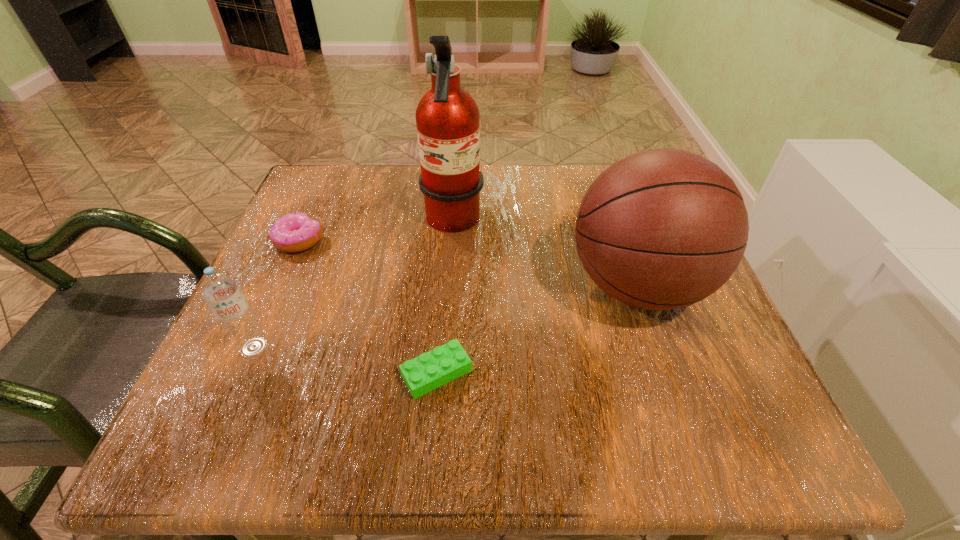
Locate an element on the screen. free spot at the near left corner of the desktop is located at coordinates (290, 424).

Find the location of a particular element. free space between the second tallest object and the water bottle is located at coordinates (445, 316).

The image size is (960, 540). What are the coordinates of `vacant area that lies between the rightmost object and the water bottle` in the screenshot? It's located at (445, 316).

Where is `vacant point located between the doughnut and the basketball`? vacant point located between the doughnut and the basketball is located at coordinates (468, 263).

This screenshot has height=540, width=960. Find the location of `empty space between the fire extinguisher and the doughnut`. empty space between the fire extinguisher and the doughnut is located at coordinates (376, 232).

Locate an element on the screen. vacant space that is in between the doughnut and the rightmost object is located at coordinates (468, 263).

Locate an element on the screen. vacant area that lies between the water bottle and the tallest object is located at coordinates (353, 285).

Where is `free space between the second shortest object and the water bottle`? Image resolution: width=960 pixels, height=540 pixels. free space between the second shortest object and the water bottle is located at coordinates (276, 294).

The image size is (960, 540). Find the location of `free space that is in between the rightmost object and the shortest object`. free space that is in between the rightmost object and the shortest object is located at coordinates (537, 329).

You are a GUI agent. You are given a task and a screenshot of the screen. Output one action in this format:
    pyautogui.click(x=<x>, y=<y>)
    Task: Click on the free space that is in between the fire extinguisher and the second shortest object
    The height and width of the screenshot is (540, 960).
    Given the screenshot: What is the action you would take?
    pyautogui.click(x=376, y=232)